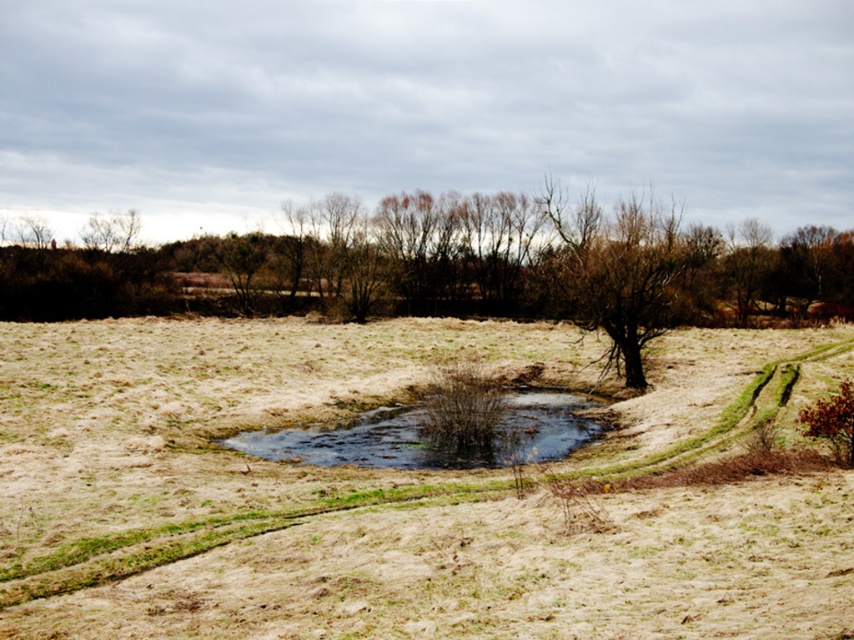
You are a farmer checking the land. You see the brown grassy field at center and the dark green water at center. Which area has a bigger surface area?

The brown grassy field at center has a larger surface area than the dark green water at center because it is described as being larger in size.